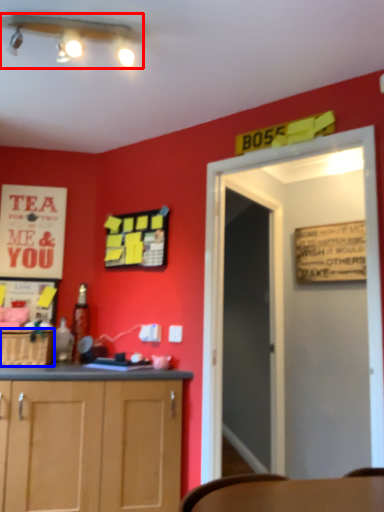
Question: Which object is closer to the camera taking this photo, light fixture (highlighted by a red box) or cabinetry (highlighted by a blue box)?

Choices:
 (A) light fixture
 (B) cabinetry

Answer: (A)